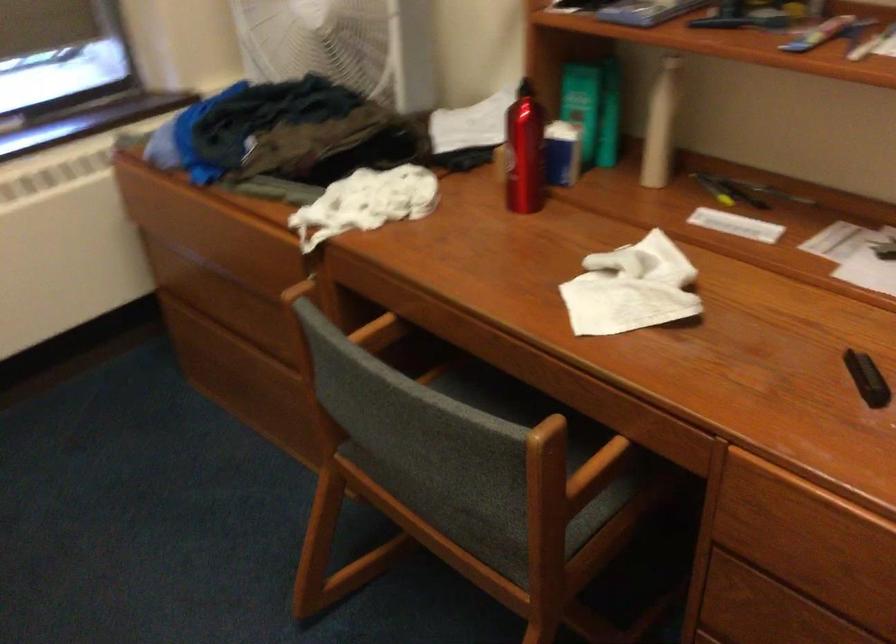
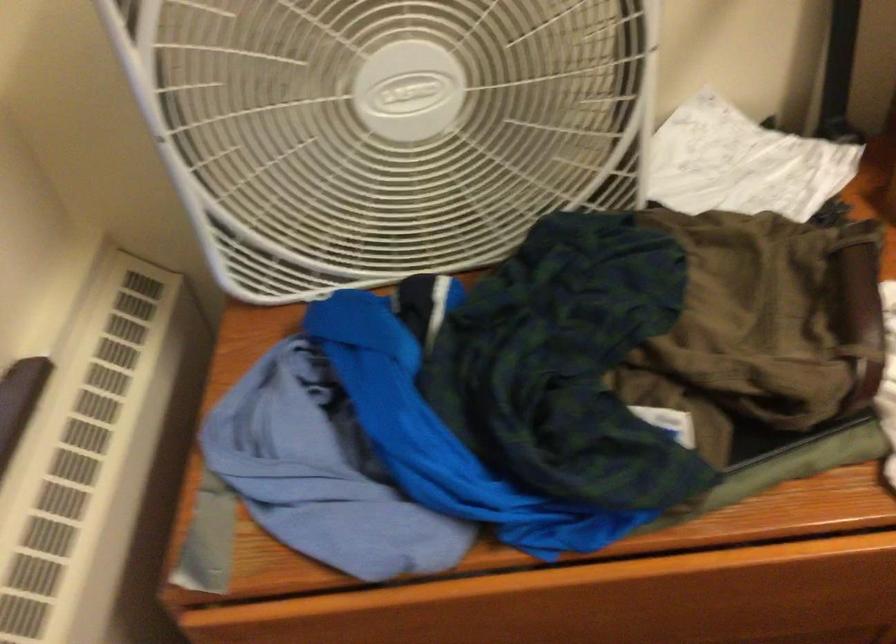
The point at (501, 128) is marked in the first image. Where is the corresponding point in the second image?

(742, 164)